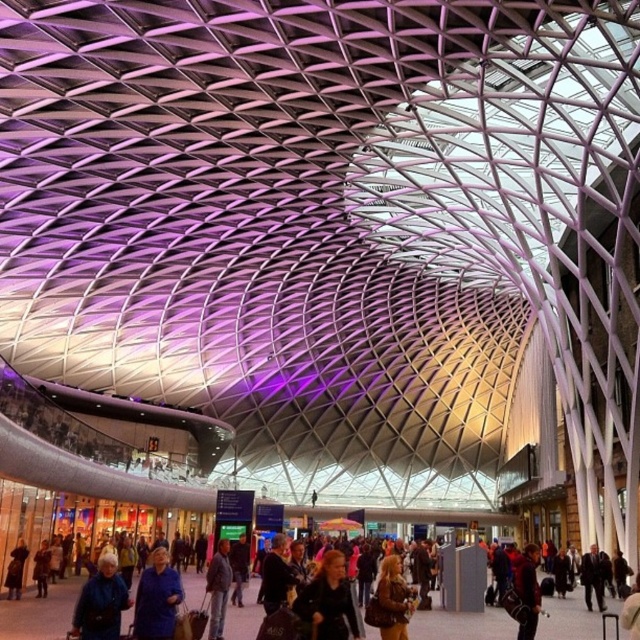
Question: Is matte black jacket at lower center wider than light brown leather jacket at center?

Choices:
 (A) yes
 (B) no

Answer: (B)

Question: Does dark blue jacket at center appear on the right side of matte blue jacket at lower left?

Choices:
 (A) yes
 (B) no

Answer: (A)

Question: Based on their relative distances, which object is farther from the matte blue jacket at lower left?

Choices:
 (A) brown leather jacket at center
 (B) light brown leather jacket at center
 (C) dark blue jacket at center

Answer: (B)

Question: Among these points, which one is nearest to the camera?

Choices:
 (A) (636, 579)
 (B) (164, 572)
 (C) (90, 628)
 (D) (72, 596)

Answer: (C)

Question: Which object is positioned farthest from the dark blue shirt at center?

Choices:
 (A) light brown leather jacket at center
 (B) red leather jacket at lower right
 (C) dark blue jacket at center

Answer: (A)

Question: Is dark blue jacket at center bigger than dark blue shirt at center?

Choices:
 (A) no
 (B) yes

Answer: (B)